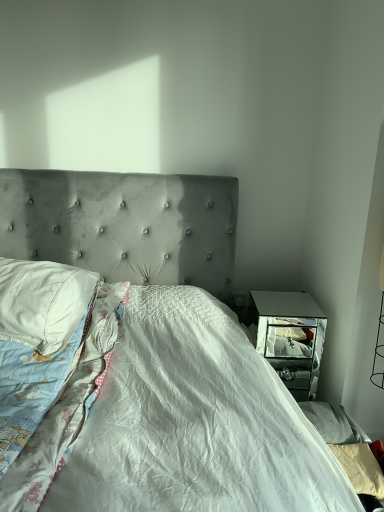
Measure the distance between white cotton blanket at left and camera.

38.16 inches.

Find the location of a particular element. This screenshot has width=384, height=512. velvet gray bed at center is located at coordinates (140, 359).

Does white cotton blanket at left have a larger size compared to velvet gray bed at center?

No.

Is white cotton blanket at left in contact with velvet gray bed at center?

No, white cotton blanket at left is not with velvet gray bed at center.

In order to click on blanket behind the velvet gray bed at center in this screenshot , I will do `click(66, 408)`.

Would you say white cotton blanket at left is to the left or to the right of velvet gray bed at center in the picture?

white cotton blanket at left is positioned on velvet gray bed at center's left side.

Is velvet gray bed at center looking in the opposite direction of white cotton pillow at left?

Yes.

Considering the positions of objects velvet gray bed at center and white cotton pillow at left in the image provided, who is in front, velvet gray bed at center or white cotton pillow at left?

velvet gray bed at center is more forward.

Which of these two, velvet gray bed at center or white cotton pillow at left, stands shorter?

white cotton pillow at left is shorter.

Consider the image. Is white cotton blanket at left looking in the opposite direction of white cotton pillow at left?

white cotton blanket at left does not have its back to white cotton pillow at left.

Are white cotton blanket at left and white cotton pillow at left far apart?

white cotton blanket at left is near white cotton pillow at left, not far away.

Which object is positioned more to the right, white cotton blanket at left or white cotton pillow at left?

white cotton blanket at left is more to the right.

Is white cotton blanket at left located outside white cotton pillow at left?

That's correct, white cotton blanket at left is outside of white cotton pillow at left.

Which object is further away from the camera taking this photo, white cotton pillow at left or velvet gray bed at center?

white cotton pillow at left is more distant.

Does white cotton pillow at left touch velvet gray bed at center?

No, white cotton pillow at left is not in contact with velvet gray bed at center.

Considering the sizes of objects white cotton pillow at left and velvet gray bed at center in the image provided, who is bigger, white cotton pillow at left or velvet gray bed at center?

velvet gray bed at center.

Is white cotton pillow at left looking in the opposite direction of velvet gray bed at center?

Yes, white cotton pillow at left is positioned with its back facing velvet gray bed at center.

Considering the relative sizes of white cotton pillow at left and white cotton blanket at left in the image provided, is white cotton pillow at left wider than white cotton blanket at left?

In fact, white cotton pillow at left might be narrower than white cotton blanket at left.

From the image's perspective, which is above, white cotton pillow at left or white cotton blanket at left?

white cotton pillow at left is shown above in the image.

Between white cotton pillow at left and white cotton blanket at left, which one is positioned behind?

white cotton pillow at left is more distant.

Is white cotton pillow at left smaller than white cotton blanket at left?

Correct, white cotton pillow at left occupies less space than white cotton blanket at left.

What's the angular difference between velvet gray bed at center and white cotton blanket at left's facing directions?

There is a 1.57-degree angle between the facing directions of velvet gray bed at center and white cotton blanket at left.

Is point (31, 335) in front of point (98, 366)?

No, (31, 335) is further to viewer.

From the image's perspective, which is above, velvet gray bed at center or white cotton blanket at left?

white cotton blanket at left.

From a real-world perspective, which object stands above the other?

velvet gray bed at center.

Locate an element on the screen. blanket above the velvet gray bed at center (from the image's perspective) is located at coordinates (66, 408).

At what (x,y) coordinates should I click in order to perform the action: click on bed in front of the white cotton pillow at left. Please return your answer as a coordinate pair (x, y). Looking at the image, I should click on (140, 359).

Which object lies nearer to the anchor point velvet gray bed at center, white cotton blanket at left or white cotton pillow at left?

white cotton blanket at left lies closer to velvet gray bed at center than the other object.

Considering their positions, is white cotton blanket at left positioned closer to white cotton pillow at left than velvet gray bed at center?

Based on the image, velvet gray bed at center appears to be nearer to white cotton pillow at left.

When comparing their distances from white cotton blanket at left, does white cotton pillow at left or velvet gray bed at center seem closer?

Among the two, velvet gray bed at center is located nearer to white cotton blanket at left.

Which object lies further to the anchor point white cotton blanket at left, velvet gray bed at center or white cotton pillow at left?

white cotton pillow at left.

Looking at the image, which one is located further to velvet gray bed at center, white cotton pillow at left or white cotton blanket at left?

white cotton pillow at left.

When comparing their distances from white cotton pillow at left, does velvet gray bed at center or white cotton blanket at left seem closer?

velvet gray bed at center lies closer to white cotton pillow at left than the other object.

Where is `blanket between velvet gray bed at center and white cotton pillow at left from front to back`? The image size is (384, 512). blanket between velvet gray bed at center and white cotton pillow at left from front to back is located at coordinates (66, 408).